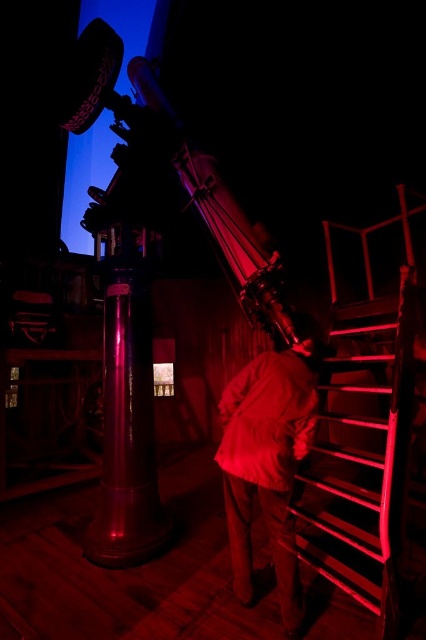
Which is above, metallic staircase at right or matte white shirt at center?

matte white shirt at center is higher up.

Identify the location of metallic staircase at right. (362, 460).

Is point (385, 605) positioned before point (226, 484)?

Yes, it is.

The width and height of the screenshot is (426, 640). In order to click on metallic staircase at right in this screenshot , I will do `click(362, 460)`.